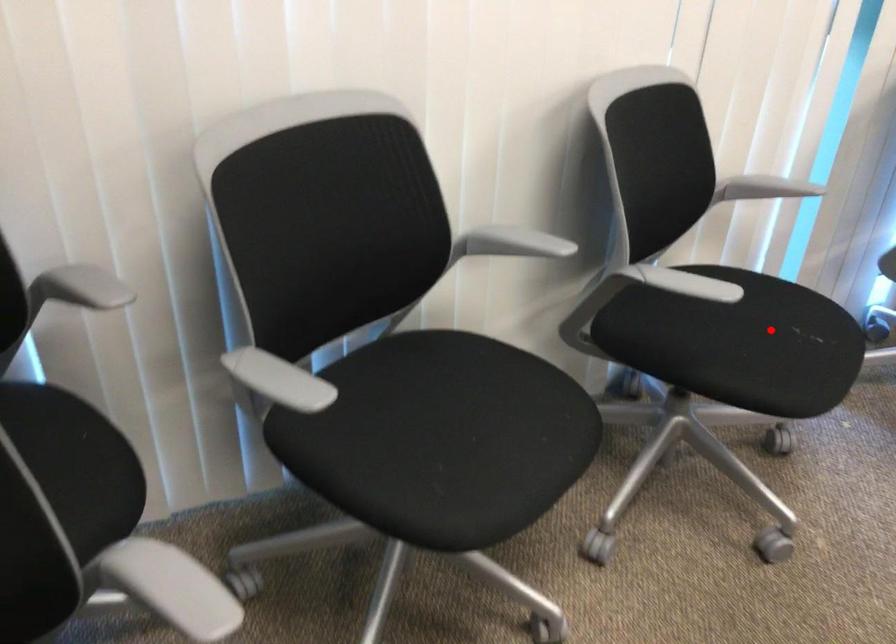
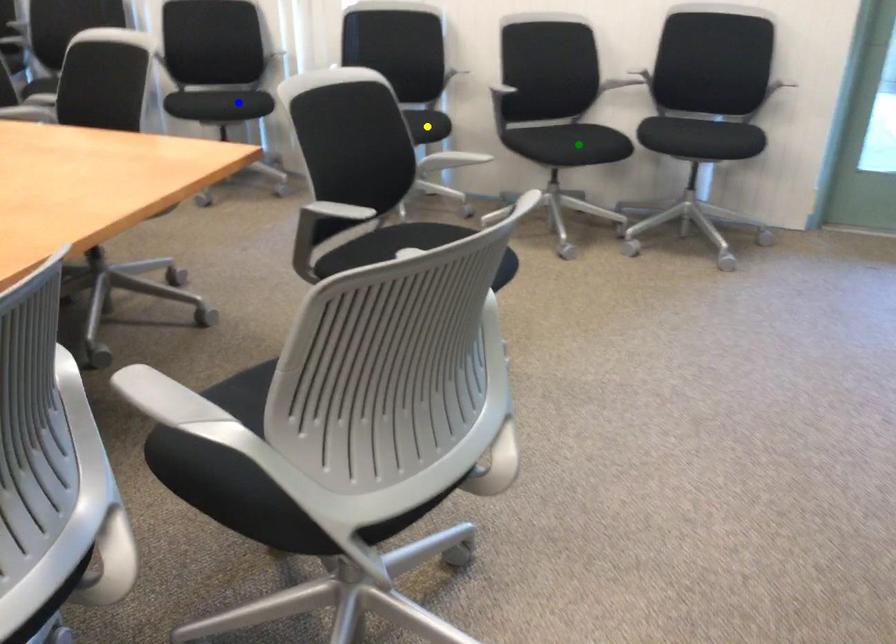
Question: I am providing you with two images of the same scene from different viewpoints. A red point is marked on the first image. You are given multiple points on the second image. Which mark in image 2 goes with the point in image 1?

Choices:
 (A) green point
 (B) blue point
 (C) yellow point

Answer: (B)